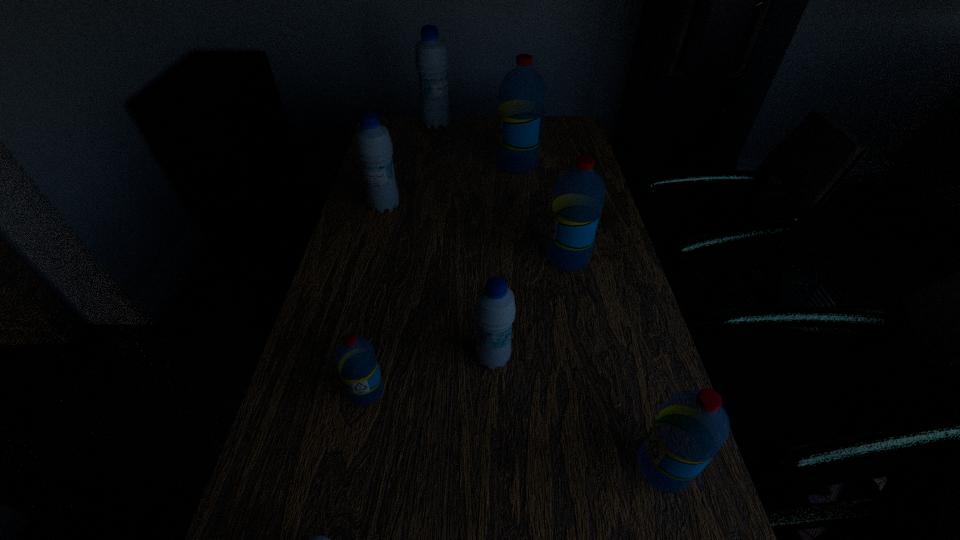
Locate an element on the screen. the farthest blue water bottle is located at coordinates (431, 58).

I want to click on the farthest water bottle, so point(431,58).

The image size is (960, 540). I want to click on the seventh nearest object, so click(x=522, y=91).

At what (x,y) coordinates should I click in order to perform the action: click on the biggest red water bottle. Please return your answer as a coordinate pair (x, y). Looking at the image, I should click on (522, 91).

The width and height of the screenshot is (960, 540). I want to click on the third farthest object, so click(373, 144).

At what (x,y) coordinates should I click in order to perform the action: click on the third farthest water bottle. Please return your answer as a coordinate pair (x, y). The height and width of the screenshot is (540, 960). Looking at the image, I should click on (373, 144).

At what (x,y) coordinates should I click in order to perform the action: click on the fourth farthest object. Please return your answer as a coordinate pair (x, y). The image size is (960, 540). Looking at the image, I should click on [x=579, y=194].

The height and width of the screenshot is (540, 960). What are the coordinates of `the fourth farthest water bottle` in the screenshot? It's located at (579, 194).

Where is `the fifth farthest object`? This screenshot has width=960, height=540. the fifth farthest object is located at coordinates (495, 309).

This screenshot has width=960, height=540. In order to click on the rightmost blue water bottle in this screenshot , I will do `click(495, 309)`.